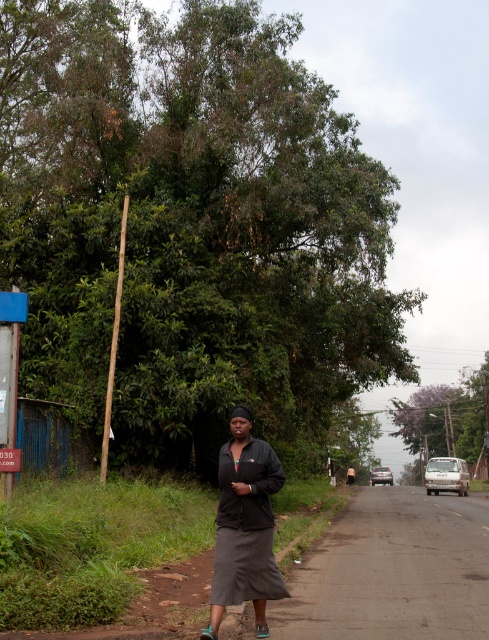
Question: Which object appears farthest from the camera in this image?

Choices:
 (A) dark gray fabric dress at center
 (B) brown fabric shirt at center

Answer: (B)

Question: Is dark gray fabric dress at center smaller than brown fabric shirt at center?

Choices:
 (A) yes
 (B) no

Answer: (A)

Question: Where is dark gray fabric dress at center located in relation to brown fabric shirt at center in the image?

Choices:
 (A) below
 (B) above

Answer: (B)

Question: Among these points, which one is nearest to the camera?

Choices:
 (A) (346, 480)
 (B) (222, 474)

Answer: (B)

Question: Which object appears farthest from the camera in this image?

Choices:
 (A) dark gray fabric dress at center
 (B) brown fabric shirt at center

Answer: (B)

Question: Can you confirm if dark gray fabric dress at center is positioned to the right of brown fabric shirt at center?

Choices:
 (A) yes
 (B) no

Answer: (B)